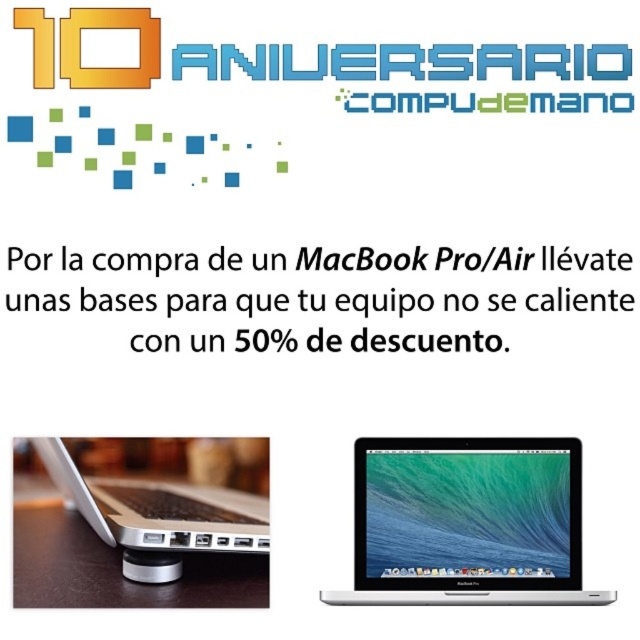
You are a customer looking at the advertisement for CompuDeMano. You see two silver metallic laptops. Where is the silver metallic laptop at center in relation to the silver metallic laptop at lower left?

The silver metallic laptop at center is to the right of the silver metallic laptop at lower left.

You are a customer looking at the CompuDeMano advertisement. There are two silver metallic laptops displayed. Which one is closer to you, the silver metallic laptop at center or the silver metallic laptop at lower left?

The silver metallic laptop at center is closer to you because it is further to the viewer than the silver metallic laptop at lower left.